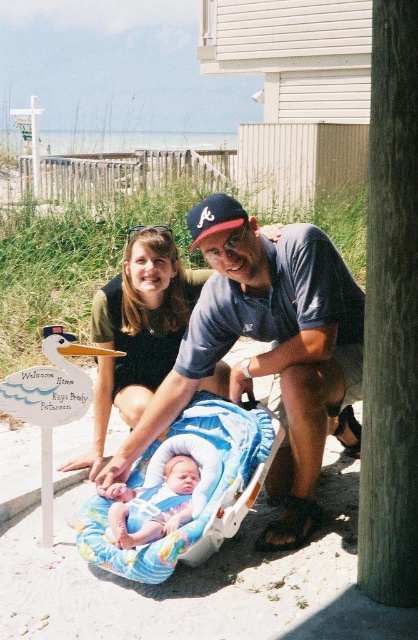
Question: Is matte black shirt at center wider than blue fabric baby carriage at center?

Choices:
 (A) yes
 (B) no

Answer: (B)

Question: Which object is farther from the camera taking this photo?

Choices:
 (A) blue fabric baby carriage at center
 (B) matte black shirt at center
 (C) blue fabric baby carrier at center

Answer: (B)

Question: Which point is closer to the camera taking this photo?

Choices:
 (A) (x=218, y=397)
 (B) (x=158, y=275)
 (C) (x=158, y=502)
 (D) (x=221, y=204)

Answer: (D)

Question: Which point is farther from the camera taking this photo?

Choices:
 (A) (130, 509)
 (B) (191, 252)

Answer: (B)

Question: Is blue fabric baby carriage at center bigger than blue fabric baseball cap at center?

Choices:
 (A) yes
 (B) no

Answer: (A)

Question: Is blue fabric baby carriage at center to the right of soft blue fabric baby car seat at center from the viewer's perspective?

Choices:
 (A) yes
 (B) no

Answer: (A)